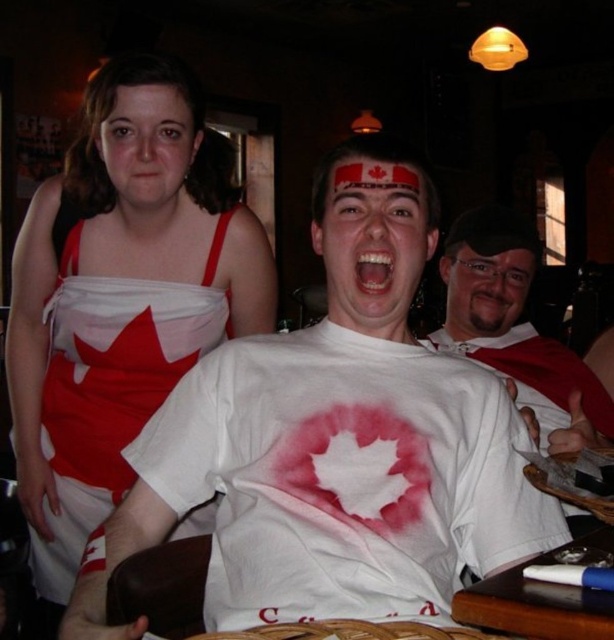
You are a photographer trying to capture a group photo of the white satin dress at upper left and the matte plastic face at center. Which object should you adjust to ensure both fit within the frame?

The white satin dress at upper left has a larger width than the matte plastic face at center, so you should adjust the camera angle or zoom to accommodate its wider size to ensure both fit within the frame.